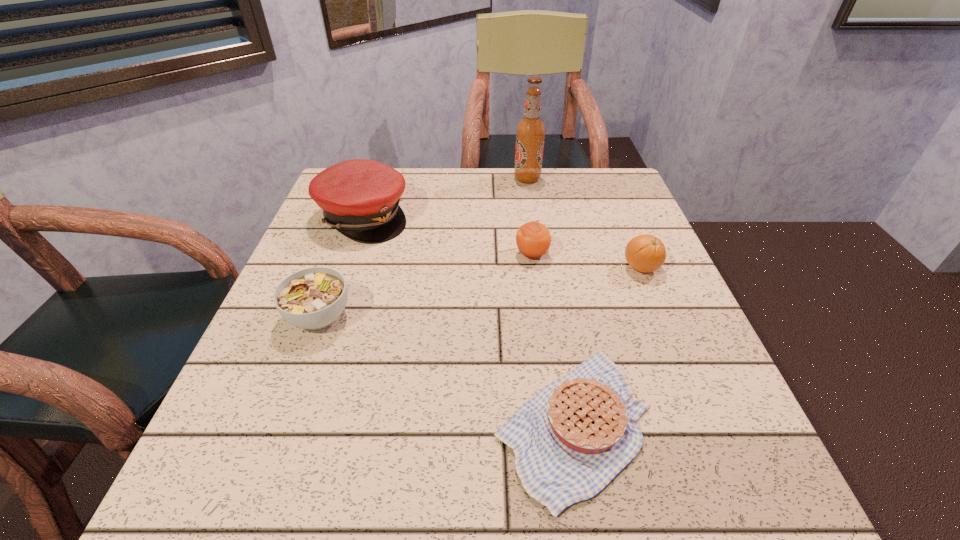
Where is `the tallest object`? This screenshot has height=540, width=960. the tallest object is located at coordinates [530, 132].

Where is `the farthest object`? This screenshot has width=960, height=540. the farthest object is located at coordinates (530, 132).

Identify the location of the second tallest object. This screenshot has height=540, width=960. (360, 198).

Find the location of a particular element. Image resolution: width=960 pixels, height=540 pixels. the left orange is located at coordinates (533, 239).

Where is `the right orange`? the right orange is located at coordinates (646, 253).

Locate an element on the screen. The height and width of the screenshot is (540, 960). soup bowl is located at coordinates (313, 298).

At what (x,y) coordinates should I click in order to perform the action: click on the nearest object. Please return your answer as a coordinate pair (x, y). The width and height of the screenshot is (960, 540). Looking at the image, I should click on pos(576,434).

Find the location of `pie`. pie is located at coordinates (576, 434).

Locate an element on the screen. The height and width of the screenshot is (540, 960). vacant region located 0.160m on the front label of the beer bottle is located at coordinates (456, 179).

Find the location of `free location located 0.240m on the front label of the beer bottle`. free location located 0.240m on the front label of the beer bottle is located at coordinates (428, 179).